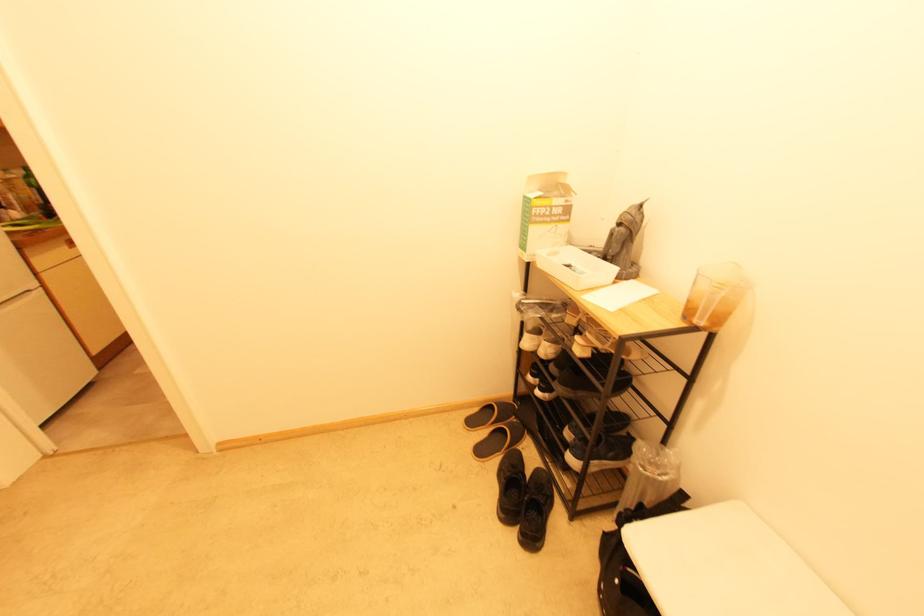
At what (x,y) coordinates should I click in order to perform the action: click on chair sitting surface. Please return your answer as a coordinate pair (x, y). The height and width of the screenshot is (616, 924). Looking at the image, I should click on (724, 572).